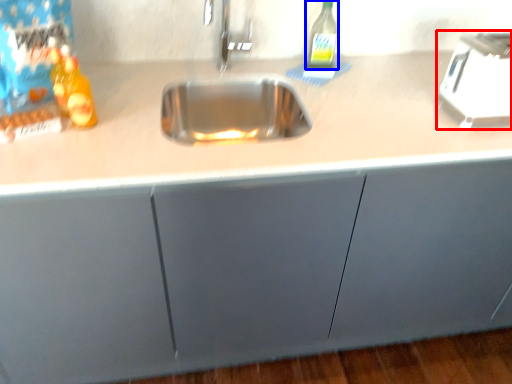
Question: Which of the following is the farthest to the observer, appliance (highlighted by a red box) or bottle (highlighted by a blue box)?

Choices:
 (A) appliance
 (B) bottle

Answer: (B)